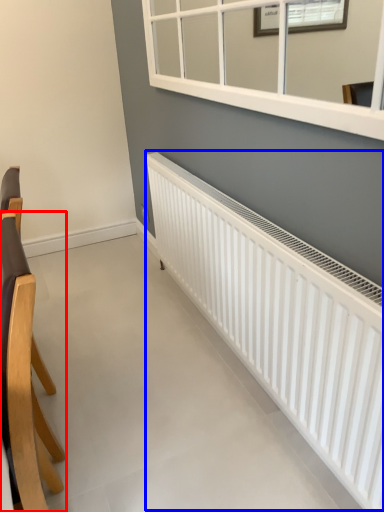
Question: Among these objects, which one is farthest to the camera, chair (highlighted by a red box) or radiator (highlighted by a blue box)?

Choices:
 (A) chair
 (B) radiator

Answer: (B)